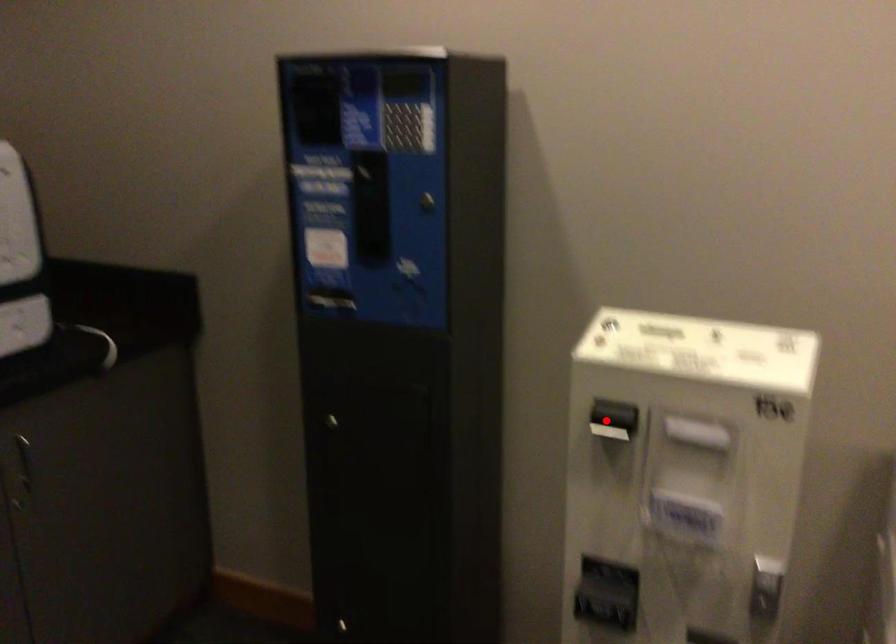
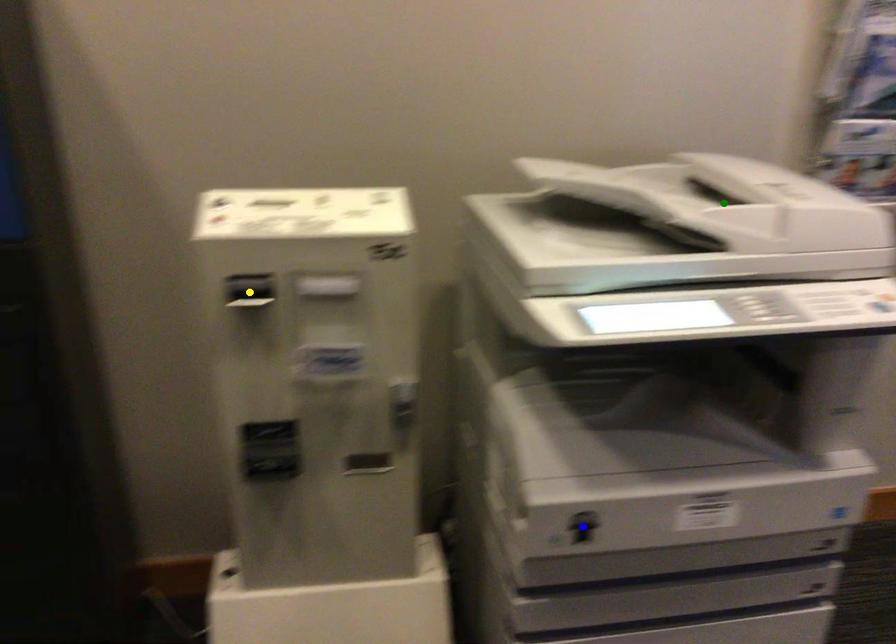
Question: I am providing you with two images of the same scene from different viewpoints. A red point is marked on the first image. You are given multiple points on the second image. Can you choose the point in image 2 that corresponds to the point in image 1?

Choices:
 (A) green point
 (B) blue point
 (C) yellow point

Answer: (C)